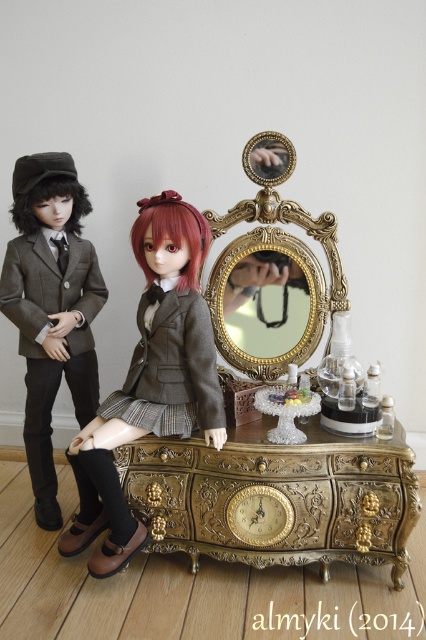
Question: Considering the relative positions of gold ornate drawer at center and gold ornate mirror at center in the image provided, where is gold ornate drawer at center located with respect to gold ornate mirror at center?

Choices:
 (A) right
 (B) left

Answer: (B)

Question: Which object is positioned farthest from the gold ornate drawer at center?

Choices:
 (A) matte gray fabric doll at center
 (B) gold ornate mirror at center
 (C) matte brown suit at left

Answer: (C)

Question: Which of these objects is positioned farthest from the gold ornate mirror at center?

Choices:
 (A) matte brown suit at left
 (B) matte gray fabric doll at center
 (C) gold ornate drawer at center

Answer: (A)

Question: Estimate the real-world distances between objects in this image. Which object is closer to the matte gray fabric doll at center?

Choices:
 (A) gold ornate mirror at center
 (B) gold ornate drawer at center
 (C) matte brown suit at left

Answer: (B)

Question: Can you confirm if gold ornate drawer at center is bigger than gold ornate mirror at center?

Choices:
 (A) yes
 (B) no

Answer: (A)

Question: Where is gold ornate drawer at center located in relation to gold ornate mirror at center in the image?

Choices:
 (A) above
 (B) below

Answer: (B)